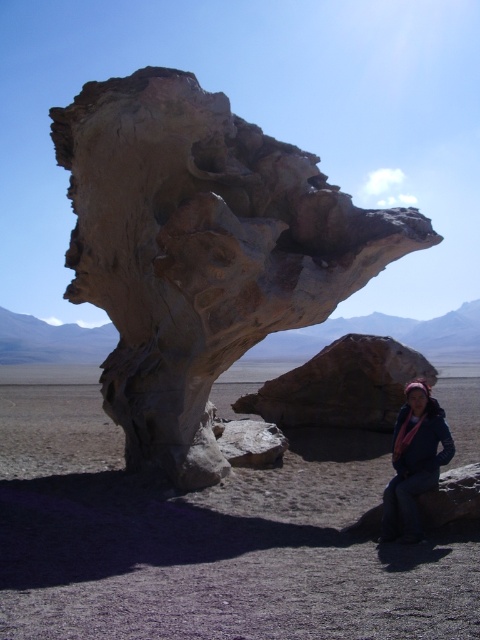
You are standing in front of the rustic stone sculpture at center and the pink scarf at lower right. Which object is taller?

The rustic stone sculpture at center is taller than the pink scarf at lower right.

You are standing in the desert and see the rustic stone sculpture at center and the pink scarf at lower right. Which object is closer to you?

The rustic stone sculpture at center is closer to you because the pink scarf at lower right is behind it.

You are a photographer wanting to capture both the rustic stone sculpture at center and the pink scarf at lower right in the same frame. Given that your camera has a maximum focal length allowing objects 5 meters apart to be in focus simultaneously, will you be able to achieve this?

The rustic stone sculpture at center and the pink scarf at lower right are 5.89 meters apart from each other. Since the maximum distance your camera can handle is 5 meters, you won number be able to capture both in focus simultaneously.